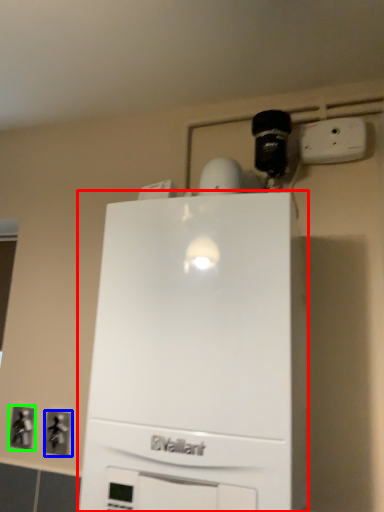
Question: Which object is the closest to the home appliance (highlighted by a red box)? Choose among these: electric outlet (highlighted by a blue box) or electric outlet (highlighted by a green box).

Choices:
 (A) electric outlet
 (B) electric outlet

Answer: (A)